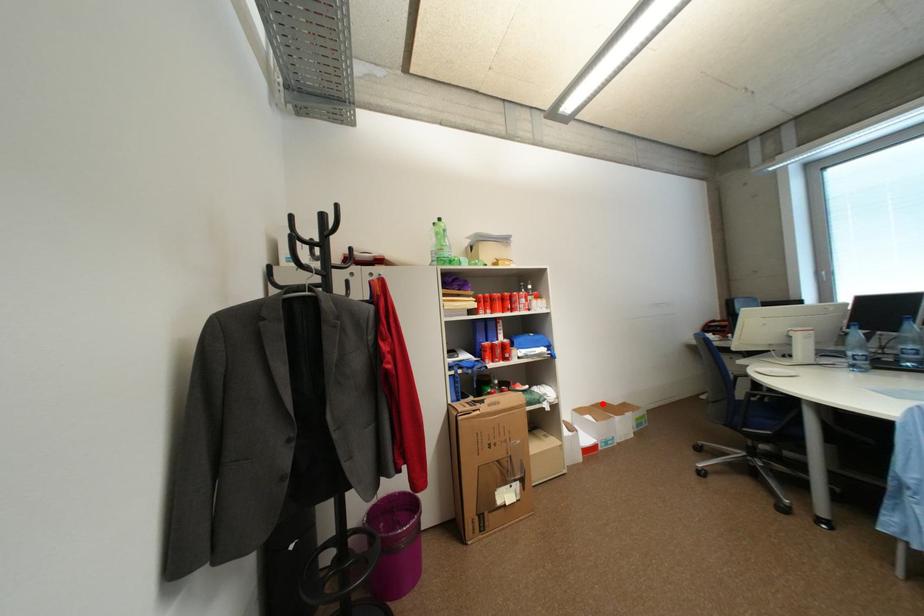
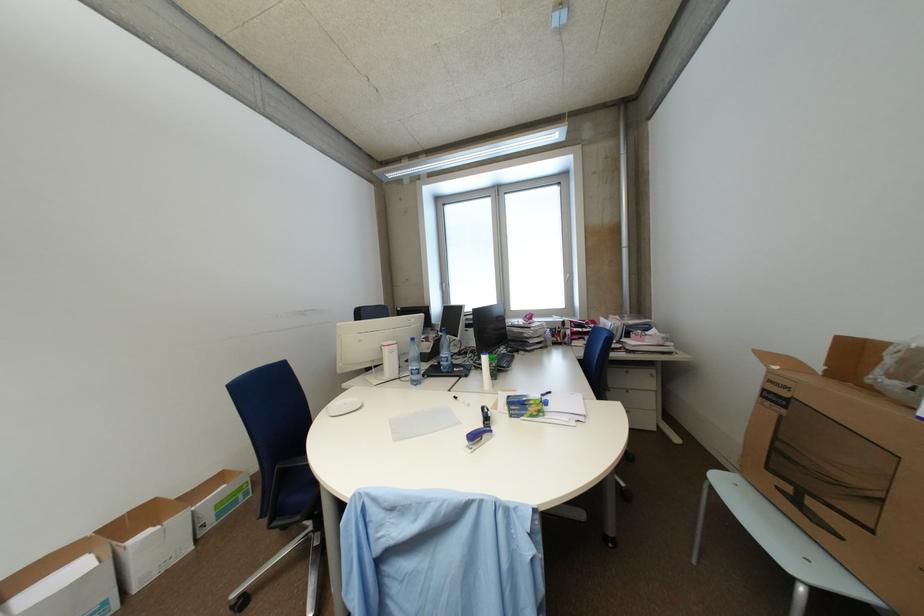
Where in the second image is the point corresponding to the highlighted location from the first image?

(131, 514)